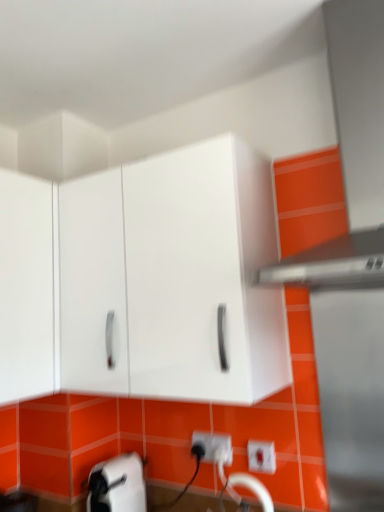
Question: Is white glossy cabinet at upper center in front of or behind white plastic electric outlet at lower center in the image?

Choices:
 (A) behind
 (B) front

Answer: (B)

Question: From a real-world perspective, is white glossy cabinet at upper center physically located above or below white plastic electric outlet at lower center?

Choices:
 (A) above
 (B) below

Answer: (A)

Question: Considering the real-world distances, which object is closest to the white glossy cabinet at upper center?

Choices:
 (A) satin silver exhaust hood at upper right
 (B) white plastic electric outlet at lower center

Answer: (A)

Question: Which is nearer to the white glossy cabinet at upper center?

Choices:
 (A) satin silver exhaust hood at upper right
 (B) white plastic electric outlet at lower center

Answer: (A)